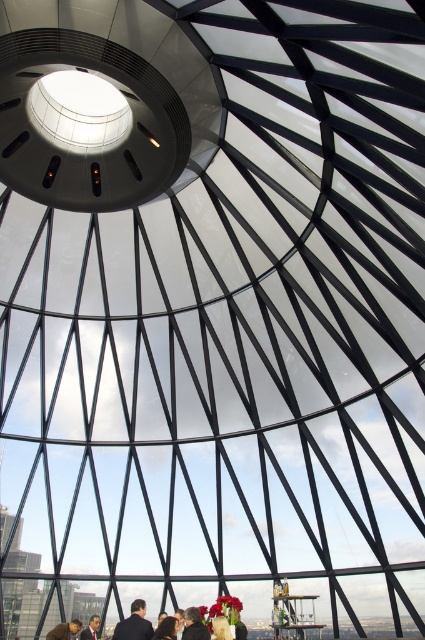
Question: Estimate the real-world distances between objects in this image. Which object is closer to the dark brown hair at lower center?

Choices:
 (A) dark suit at lower left
 (B) smooth skin person at lower center
 (C) dark suit at center

Answer: (B)

Question: Estimate the real-world distances between objects in this image. Which object is farther from the dark suit at center?

Choices:
 (A) blonde hair at lower center
 (B) smooth skin person at lower center
 (C) dark blue suit at lower center

Answer: (C)

Question: Does smooth skin person at lower center appear over dark brown hair at lower center?

Choices:
 (A) yes
 (B) no

Answer: (B)

Question: Is dark brown hair at lower center to the right of blonde hair at lower center from the viewer's perspective?

Choices:
 (A) no
 (B) yes

Answer: (A)

Question: Which point appears closest to the camera in this image?

Choices:
 (A) coord(221,627)
 (B) coord(85,632)
 (C) coord(65,632)

Answer: (A)

Question: Is smooth skin person at lower center positioned before blonde hair at lower center?

Choices:
 (A) yes
 (B) no

Answer: (A)